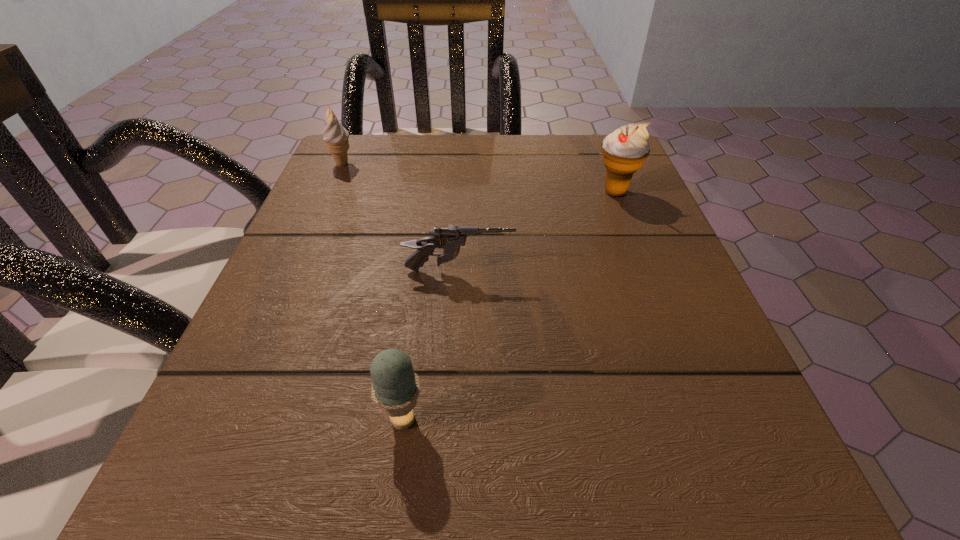
You are a GUI agent. You are given a task and a screenshot of the screen. Output one action in this format:
    pyautogui.click(x=<x>, y=<y>)
    Task: Click on the blank area at the far left corner
    This screenshot has height=540, width=960.
    Given the screenshot: What is the action you would take?
    pyautogui.click(x=350, y=190)

This screenshot has width=960, height=540. I want to click on blank area at the far right corner, so 588,174.

The image size is (960, 540). In the image, there is a desktop. In order to click on blank space at the near right corner in this screenshot , I will do `click(753, 447)`.

Where is `free area in between the second nearest ice cream and the leftmost object`? The height and width of the screenshot is (540, 960). free area in between the second nearest ice cream and the leftmost object is located at coordinates click(478, 178).

Where is `vacant space that's between the farthest object and the nearest object`? The width and height of the screenshot is (960, 540). vacant space that's between the farthest object and the nearest object is located at coordinates (372, 292).

This screenshot has width=960, height=540. What are the coordinates of `free space between the second farthest object and the second ice cream from left to right` in the screenshot? It's located at (509, 306).

Where is `vacant space that's between the second farthest object and the leftmost ice cream`? The height and width of the screenshot is (540, 960). vacant space that's between the second farthest object and the leftmost ice cream is located at coordinates (478, 178).

The image size is (960, 540). What are the coordinates of `empty space that is in between the second nearest object and the rightmost ice cream` in the screenshot? It's located at (537, 232).

What are the coordinates of `vacant space that is in between the shortest object and the farthest ice cream` in the screenshot? It's located at (400, 217).

The image size is (960, 540). Find the location of `vacant area that lies between the rightmost ice cream and the leftmost ice cream`. vacant area that lies between the rightmost ice cream and the leftmost ice cream is located at coordinates (478, 178).